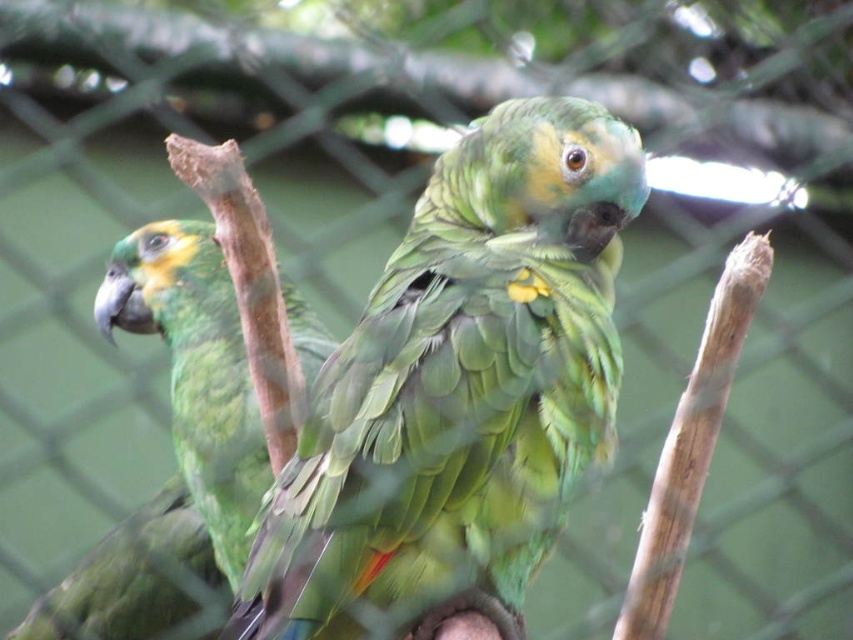
Question: Is green matte parrot at center bigger than green matte parrot at left?

Choices:
 (A) no
 (B) yes

Answer: (B)

Question: Can you confirm if green matte parrot at center is positioned below green matte parrot at left?

Choices:
 (A) yes
 (B) no

Answer: (B)

Question: Among these objects, which one is nearest to the camera?

Choices:
 (A) green matte parrot at center
 (B) green matte parrot at left

Answer: (A)

Question: Does green matte parrot at center appear under green matte parrot at left?

Choices:
 (A) no
 (B) yes

Answer: (A)

Question: Which point is closer to the camera taking this photo?

Choices:
 (A) (206, 275)
 (B) (387, 502)

Answer: (B)